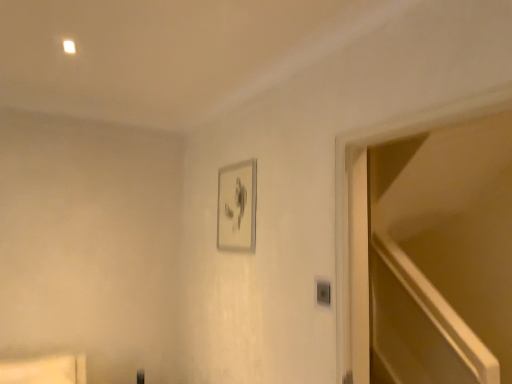
Measure the distance between matte wood shelf at lower left and camera.

matte wood shelf at lower left is 7.64 feet away from camera.

The height and width of the screenshot is (384, 512). Identify the location of matte wood shelf at lower left. (45, 370).

Can you confirm if silver metallic picture frame at upper center is taller than transparent glass door at right?

No, silver metallic picture frame at upper center is not taller than transparent glass door at right.

Measure the distance from silver metallic picture frame at upper center to transparent glass door at right.

silver metallic picture frame at upper center and transparent glass door at right are 1.41 meters apart from each other.

Is silver metallic picture frame at upper center bigger or smaller than transparent glass door at right?

Considering their sizes, silver metallic picture frame at upper center takes up less space than transparent glass door at right.

Is silver metallic picture frame at upper center aimed at transparent glass door at right?

No, silver metallic picture frame at upper center is not facing towards transparent glass door at right.

Which of these two, transparent glass door at right or matte wood shelf at lower left, is bigger?

With larger size is transparent glass door at right.

How many degrees apart are the facing directions of transparent glass door at right and matte wood shelf at lower left?

The facing directions of transparent glass door at right and matte wood shelf at lower left are 91.1 degrees apart.

Which object is closer to the camera taking this photo, transparent glass door at right or matte wood shelf at lower left?

transparent glass door at right is closer to the camera.

From a real-world perspective, is transparent glass door at right above or below matte wood shelf at lower left?

From a real-world perspective, transparent glass door at right is physically above matte wood shelf at lower left.

Is transparent glass door at right bigger or smaller than silver metallic picture frame at upper center?

transparent glass door at right is bigger than silver metallic picture frame at upper center.

Are transparent glass door at right and silver metallic picture frame at upper center beside each other?

transparent glass door at right and silver metallic picture frame at upper center are clearly separated.

Does transparent glass door at right appear on the left side of silver metallic picture frame at upper center?

In fact, transparent glass door at right is to the right of silver metallic picture frame at upper center.

Which object is thinner, transparent glass door at right or silver metallic picture frame at upper center?

silver metallic picture frame at upper center.

Which of these two, silver metallic picture frame at upper center or matte wood shelf at lower left, stands shorter?

With less height is matte wood shelf at lower left.

Would you say silver metallic picture frame at upper center is to the left or to the right of matte wood shelf at lower left in the picture?

In the image, silver metallic picture frame at upper center appears on the right side of matte wood shelf at lower left.

Considering the points (246, 220) and (28, 382), which point is behind, point (246, 220) or point (28, 382)?

The point (246, 220) is behind.

From the image's perspective, which one is positioned higher, matte wood shelf at lower left or transparent glass door at right?

From the image's view, transparent glass door at right is above.

Considering the relative sizes of matte wood shelf at lower left and transparent glass door at right in the image provided, is matte wood shelf at lower left shorter than transparent glass door at right?

Yes.

Is matte wood shelf at lower left positioned behind transparent glass door at right?

Yes, matte wood shelf at lower left is further from the camera.

Is matte wood shelf at lower left positioned with its back to transparent glass door at right?

No, matte wood shelf at lower left is not facing the opposite direction of transparent glass door at right.

From the image's perspective, is matte wood shelf at lower left located above silver metallic picture frame at upper center?

No, from the image's perspective, matte wood shelf at lower left is not above silver metallic picture frame at upper center.

The height and width of the screenshot is (384, 512). In order to click on furniture in front of the silver metallic picture frame at upper center in this screenshot , I will do `click(45, 370)`.

Can you confirm if matte wood shelf at lower left is shorter than silver metallic picture frame at upper center?

Yes, matte wood shelf at lower left is shorter than silver metallic picture frame at upper center.

Is there a large distance between matte wood shelf at lower left and silver metallic picture frame at upper center?

Yes, matte wood shelf at lower left and silver metallic picture frame at upper center are located far from each other.

At what (x,y) coordinates should I click in order to perform the action: click on glass door beneath the silver metallic picture frame at upper center (from a real-world perspective). Please return your answer as a coordinate pair (x, y). Looking at the image, I should click on (434, 257).

The width and height of the screenshot is (512, 384). Find the location of `furniture below the transparent glass door at right (from the image's perspective)`. furniture below the transparent glass door at right (from the image's perspective) is located at coordinates (45, 370).

From the image, which object appears to be farther from silver metallic picture frame at upper center, matte wood shelf at lower left or transparent glass door at right?

transparent glass door at right lies further to silver metallic picture frame at upper center than the other object.

Considering their positions, is silver metallic picture frame at upper center positioned further to transparent glass door at right than matte wood shelf at lower left?

matte wood shelf at lower left is positioned further to the anchor transparent glass door at right.

From the image, which object appears to be farther from transparent glass door at right, matte wood shelf at lower left or silver metallic picture frame at upper center?

Based on the image, matte wood shelf at lower left appears to be further to transparent glass door at right.

Estimate the real-world distances between objects in this image. Which object is closer to matte wood shelf at lower left, silver metallic picture frame at upper center or transparent glass door at right?

silver metallic picture frame at upper center is closer to matte wood shelf at lower left.

Estimate the real-world distances between objects in this image. Which object is further from silver metallic picture frame at upper center, transparent glass door at right or matte wood shelf at lower left?

Answer: transparent glass door at right.

Based on their spatial positions, is transparent glass door at right or silver metallic picture frame at upper center closer to matte wood shelf at lower left?

Based on the image, silver metallic picture frame at upper center appears to be nearer to matte wood shelf at lower left.

Find the location of a particular element. picture frame between matte wood shelf at lower left and transparent glass door at right is located at coordinates (237, 206).